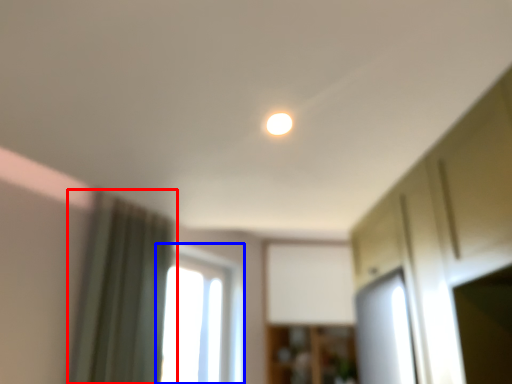
Question: Which object is closer to the camera taking this photo, curtain (highlighted by a red box) or window (highlighted by a blue box)?

Choices:
 (A) curtain
 (B) window

Answer: (A)